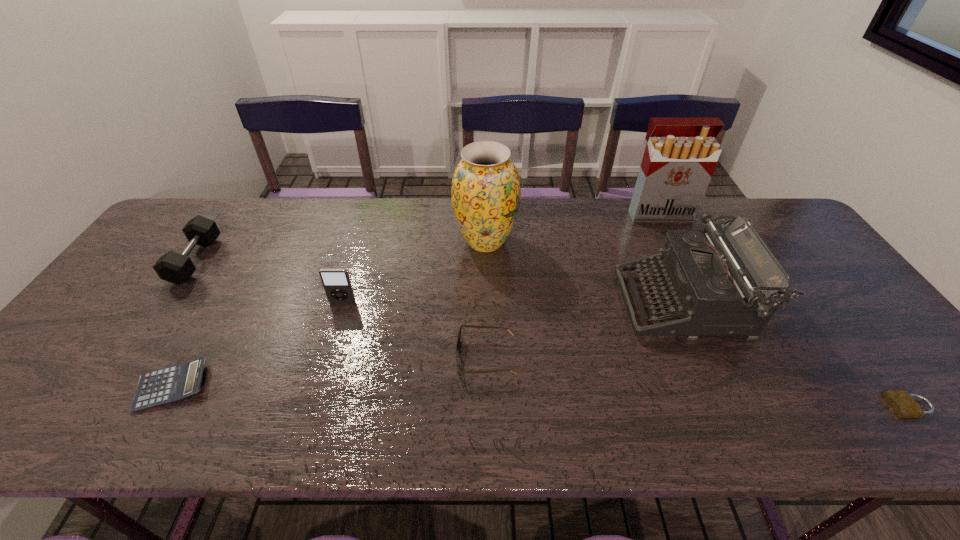
In order to click on free space between the cigarette case and the calculator in this screenshot , I will do `click(416, 300)`.

Where is `vacant space in between the rightmost object and the leftmost object`? The image size is (960, 540). vacant space in between the rightmost object and the leftmost object is located at coordinates pos(552,333).

The width and height of the screenshot is (960, 540). Identify the location of free space between the sixth object from right to left and the dumbbell. (269, 281).

Find the location of a particular element. free point between the dumbbell and the typewriter is located at coordinates (440, 282).

Image resolution: width=960 pixels, height=540 pixels. Identify the location of vacant region between the sixth shortest object and the sixth object from right to left. (514, 303).

Where is `vacant area between the sixth tallest object and the farthest object`? The height and width of the screenshot is (540, 960). vacant area between the sixth tallest object and the farthest object is located at coordinates (572, 286).

Find the location of a particular element. The height and width of the screenshot is (540, 960). vacant area between the sunglasses and the farthest object is located at coordinates (572, 286).

The image size is (960, 540). What are the coordinates of `free space between the dumbbell and the vase` in the screenshot? It's located at (341, 251).

Find the location of `empty location between the sixth tallest object and the second shortest object`. empty location between the sixth tallest object and the second shortest object is located at coordinates (329, 372).

At what (x,y) coordinates should I click in order to perform the action: click on object that is the fifth closest to the padlock. Please return your answer as a coordinate pair (x, y). Looking at the image, I should click on (336, 282).